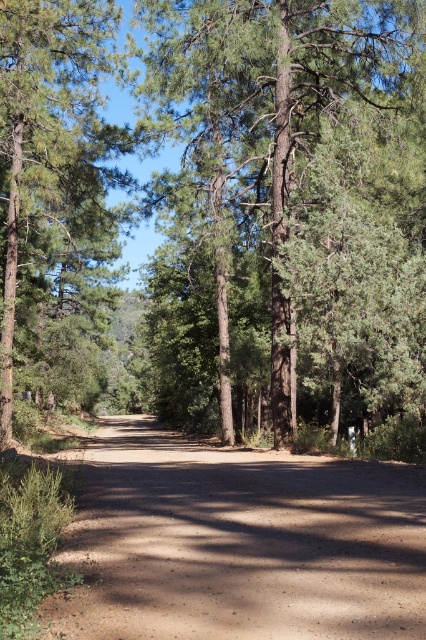
Where is `green textured tree at center`? The width and height of the screenshot is (426, 640). green textured tree at center is located at coordinates (290, 209).

Is green textured tree at center to the right of brown gravel road at center from the viewer's perspective?

Indeed, green textured tree at center is positioned on the right side of brown gravel road at center.

Based on the photo, who is more distant from viewer, (339, 109) or (147, 454)?

Positioned behind is point (147, 454).

This screenshot has height=640, width=426. Find the location of `green textured tree at center`. green textured tree at center is located at coordinates (290, 209).

Is brown gravel road at center positioned at the back of green matte tree at left?

No.

This screenshot has width=426, height=640. What do you see at coordinates (238, 544) in the screenshot?
I see `brown gravel road at center` at bounding box center [238, 544].

Find the location of a particular element. brown gravel road at center is located at coordinates (238, 544).

Between green textured tree at center and green matte tree at left, which one has less height?

green textured tree at center

Where is `green textured tree at center`? green textured tree at center is located at coordinates (290, 209).

Does point (417, 42) lie in front of point (100, 387)?

Yes.

This screenshot has height=640, width=426. I want to click on green textured tree at center, so click(290, 209).